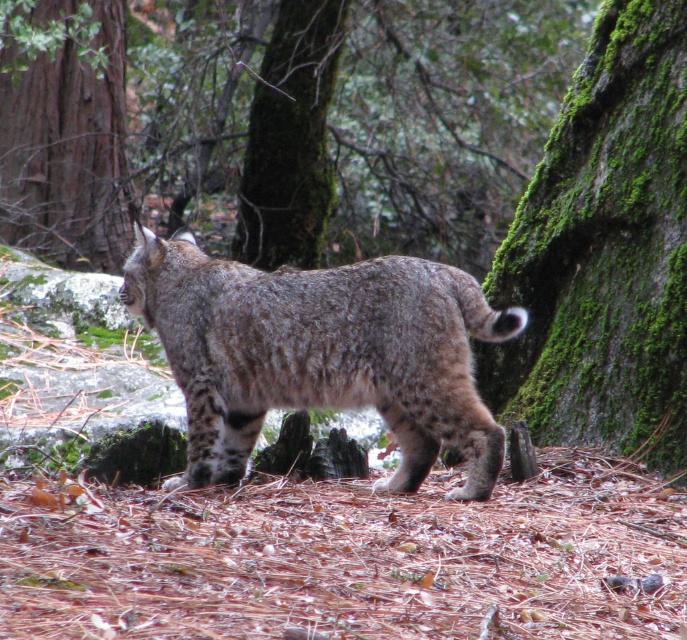
Question: Among these points, which one is nearest to the camera?

Choices:
 (A) (653, 321)
 (B) (56, 60)

Answer: (A)

Question: Which object is farther from the camera taking this photo?

Choices:
 (A) green mossy bark at right
 (B) green mossy tree trunk at center
 (C) brown rough tree trunk at upper left

Answer: (B)

Question: Is brown rough tree trunk at upper left further to the viewer compared to green mossy tree trunk at center?

Choices:
 (A) no
 (B) yes

Answer: (A)

Question: From the image, what is the correct spatial relationship of green mossy bark at right in relation to green mossy tree trunk at center?

Choices:
 (A) above
 (B) below

Answer: (B)

Question: Does green mossy bark at right come in front of brown rough tree trunk at upper left?

Choices:
 (A) no
 (B) yes

Answer: (B)

Question: Considering the real-world distances, which object is closest to the green mossy tree trunk at center?

Choices:
 (A) green mossy bark at right
 (B) brown rough tree trunk at upper left

Answer: (B)